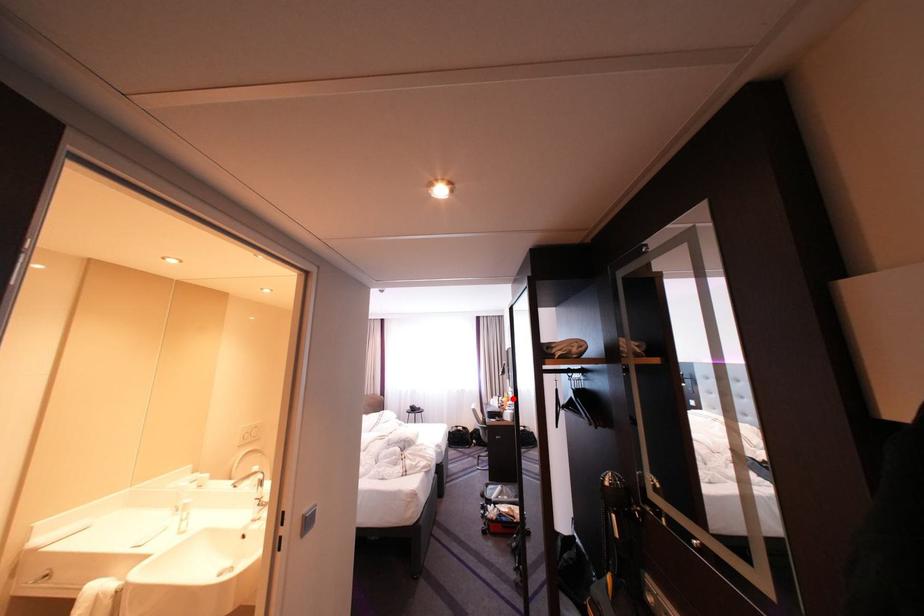
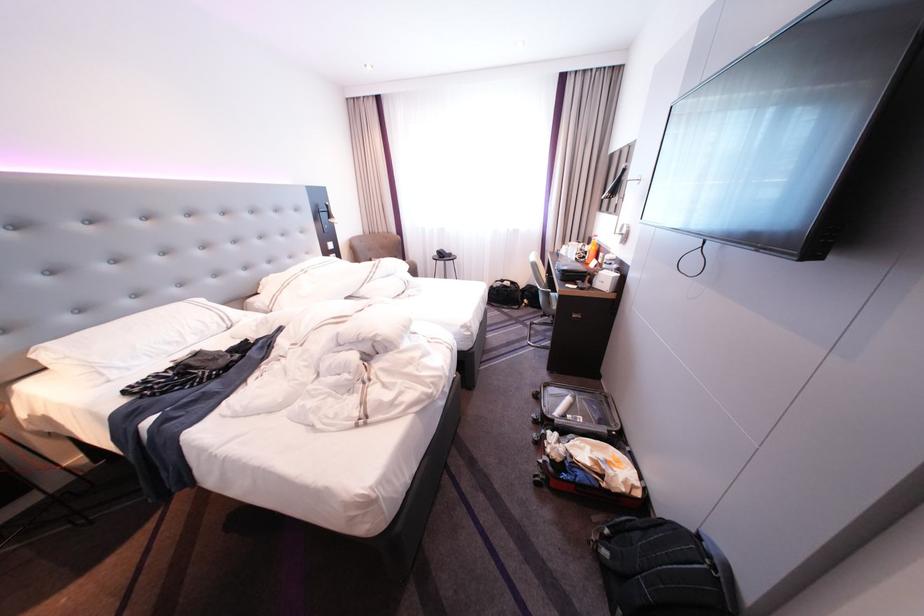
Question: I am providing you with two images of the same scene from different viewpoints. In image1, a red point is highlighted. Considering the same 3D point in image2, which of the following is correct?

Choices:
 (A) It is closer
 (B) It is farther

Answer: (A)